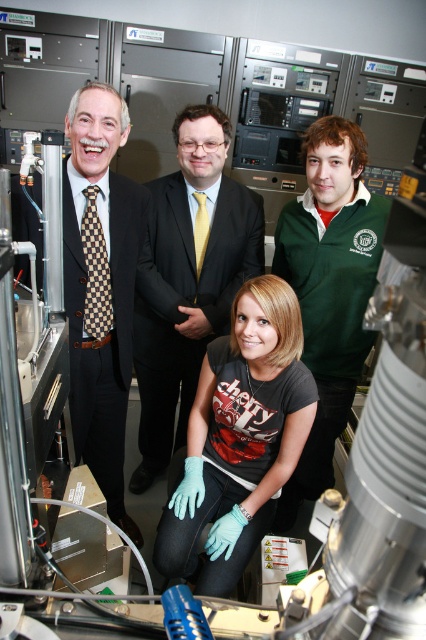
Question: Which object appears closest to the camera in this image?

Choices:
 (A) green fleece jacket at upper right
 (B) matte black suit at left

Answer: (B)

Question: Is matte black suit at center below matte black suit at left?

Choices:
 (A) no
 (B) yes

Answer: (A)

Question: Is teal fabric gloves at lower center thinner than matte black suit at center?

Choices:
 (A) yes
 (B) no

Answer: (A)

Question: Which object is positioned farthest from the teal fabric gloves at lower center?

Choices:
 (A) green fleece jacket at upper right
 (B) matte black suit at left

Answer: (A)

Question: Does teal fabric gloves at lower center appear on the right side of matte black suit at center?

Choices:
 (A) no
 (B) yes

Answer: (B)

Question: Which object appears closest to the camera in this image?

Choices:
 (A) matte black suit at center
 (B) teal fabric gloves at lower center
 (C) matte black suit at left

Answer: (C)